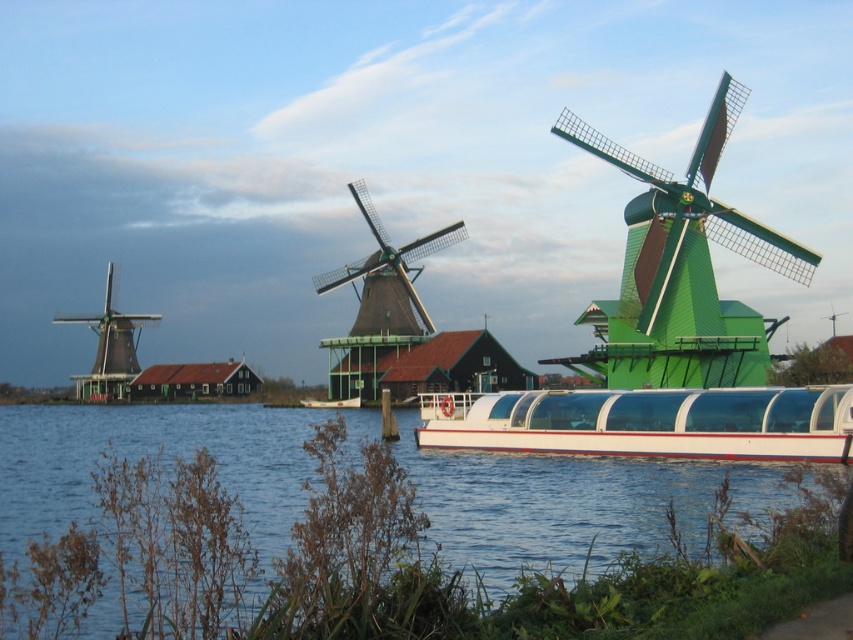
Question: Can you confirm if green matte windmill at center is positioned below green wooden windmill at center?

Choices:
 (A) no
 (B) yes

Answer: (A)

Question: Does green matte windmill at center have a greater width compared to green wooden windmill at center?

Choices:
 (A) no
 (B) yes

Answer: (B)

Question: Can you confirm if blue water at lower center is positioned below green wooden windmill at center?

Choices:
 (A) yes
 (B) no

Answer: (A)

Question: Which object is positioned farthest from the green wooden windmill at center?

Choices:
 (A) white glossy boat at center
 (B) green wooden windmill at left
 (C) white glossy boat at lower center
 (D) blue water at lower center

Answer: (D)

Question: Which object is farther from the camera taking this photo?

Choices:
 (A) green wooden windmill at center
 (B) green matte windmill at center

Answer: (A)

Question: Which point is farther to the camera?

Choices:
 (A) (352, 397)
 (B) (425, 316)
 (C) (724, 324)

Answer: (B)